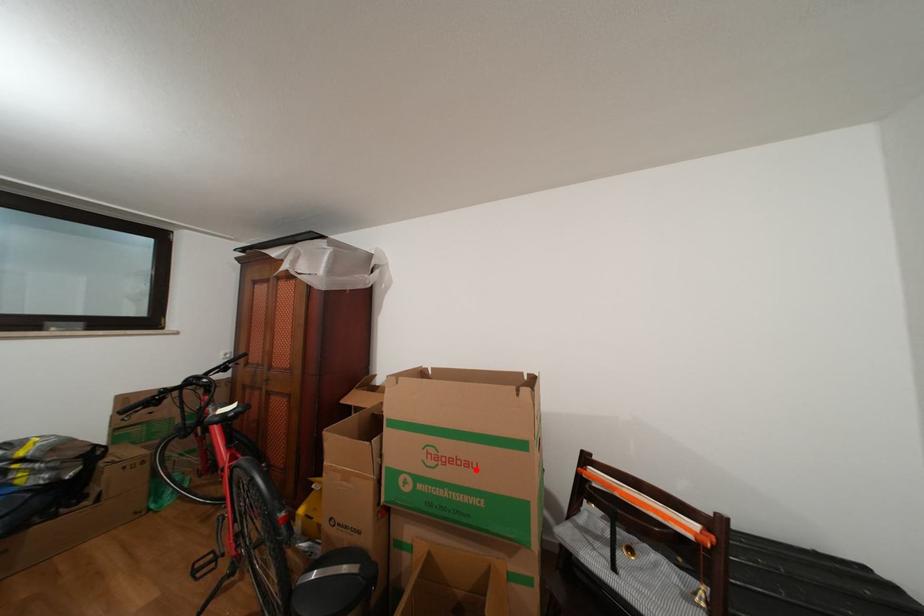
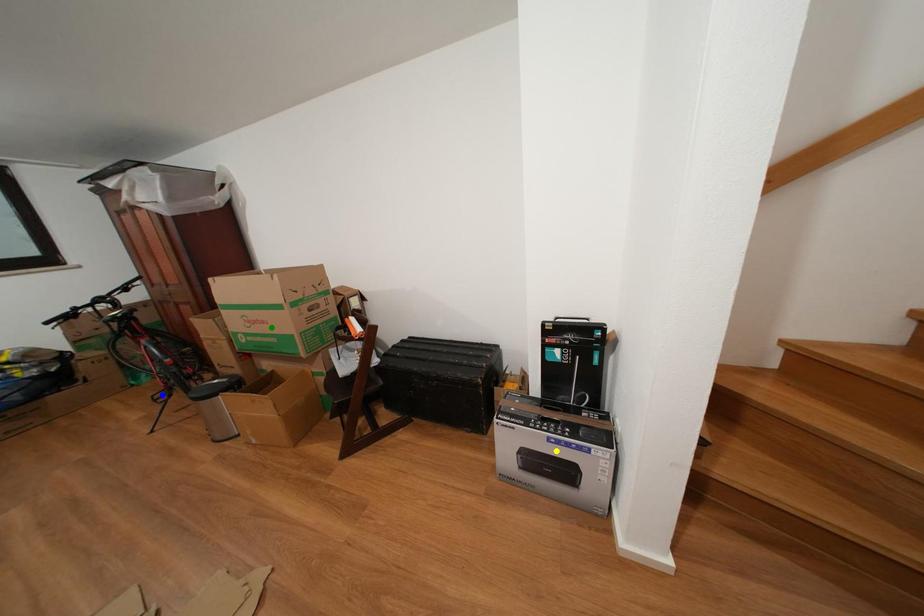
Question: I am providing you with two images of the same scene from different viewpoints. A red point is marked on the first image. You are given multiple points on the second image. In image 2, which mark is for the same physical point as the one in image 1?

Choices:
 (A) blue point
 (B) green point
 (C) yellow point

Answer: (B)